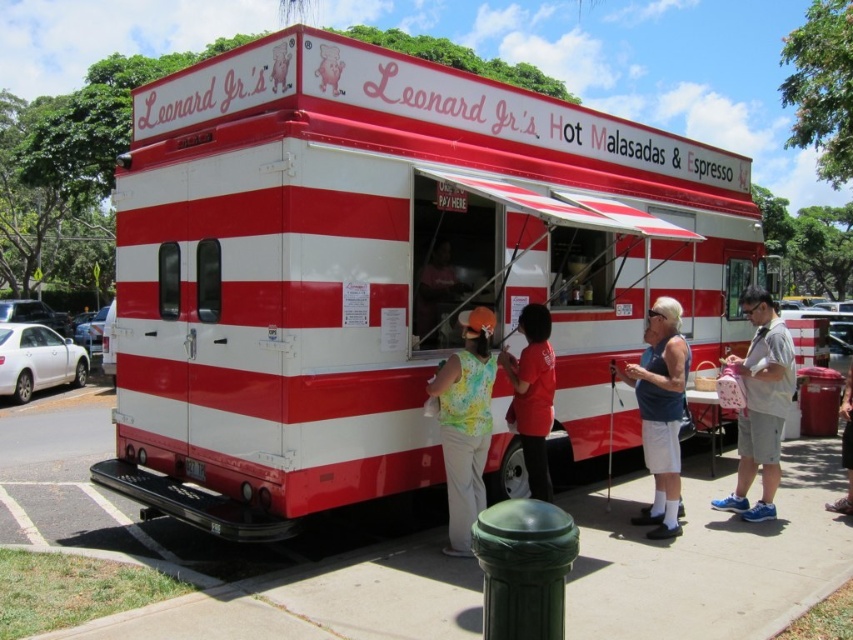
Question: Which object is farther from the camera taking this photo?

Choices:
 (A) red matte shirt at center
 (B) red and white striped food truck at center

Answer: (A)

Question: Is the position of floral sleeveless top at center more distant than that of blue fabric tank top at center?

Choices:
 (A) no
 (B) yes

Answer: (A)

Question: Does floral sleeveless top at center appear over light gray shorts at right?

Choices:
 (A) yes
 (B) no

Answer: (B)

Question: Which object is the closest to the red matte shirt at center?

Choices:
 (A) blue fabric tank top at center
 (B) light gray shorts at right
 (C) red and white striped food truck at center

Answer: (C)

Question: Which of these objects is positioned farthest from the blue fabric tank top at center?

Choices:
 (A) red matte shirt at center
 (B) light gray shorts at right
 (C) floral sleeveless top at center
 (D) red and white striped food truck at center

Answer: (D)

Question: Is red and white striped food truck at center behind floral sleeveless top at center?

Choices:
 (A) yes
 (B) no

Answer: (B)